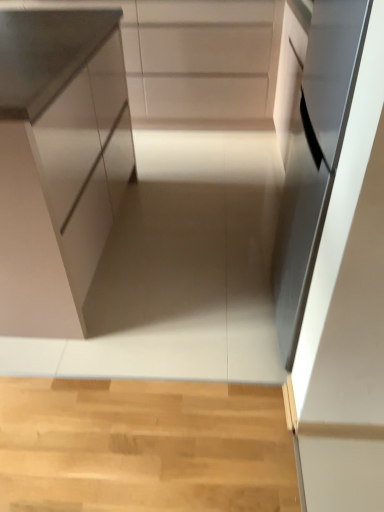
Identify the location of satin black oven at right. (315, 157).

The width and height of the screenshot is (384, 512). Describe the element at coordinates (58, 162) in the screenshot. I see `satin white cabinet at left, the second cabinetry when ordered from top to bottom` at that location.

Identify the location of satin white cabinet at left, which is the 1th cabinetry in bottom-to-top order. (58, 162).

Locate an element on the screen. The image size is (384, 512). white matte cabinet at upper center, the 2th cabinetry positioned from the bottom is located at coordinates (208, 60).

Based on the photo, from the image's perspective, is white matte cabinet at upper center, positioned as the first cabinetry in top-to-bottom order, above satin black oven at right?

Correct, white matte cabinet at upper center, positioned as the first cabinetry in top-to-bottom order, appears higher than satin black oven at right in the image.

How different are the orientations of white matte cabinet at upper center, marked as the 1th cabinetry in a back-to-front arrangement, and satin black oven at right in degrees?

The angular difference between white matte cabinet at upper center, marked as the 1th cabinetry in a back-to-front arrangement, and satin black oven at right is 90 degrees.

Is the surface of white matte cabinet at upper center, positioned as the first cabinetry in top-to-bottom order, in direct contact with satin black oven at right?

They are not placed beside each other.

From a real-world perspective, is white matte cabinet at upper center, marked as the 1th cabinetry in a back-to-front arrangement, on satin black oven at right?

No, from a real-world perspective, white matte cabinet at upper center, marked as the 1th cabinetry in a back-to-front arrangement, is not over satin black oven at right

From the image's perspective, which object appears higher, satin black oven at right or satin white cabinet at left, the second cabinetry when ordered from top to bottom?

satin white cabinet at left, the second cabinetry when ordered from top to bottom.

Is satin black oven at right turned away from satin white cabinet at left, the second cabinetry when ordered from back to front?

No, satin black oven at right's orientation is not away from satin white cabinet at left, the second cabinetry when ordered from back to front.

Between satin black oven at right and satin white cabinet at left, the second cabinetry when ordered from top to bottom, which one appears on the right side from the viewer's perspective?

satin black oven at right is more to the right.

Which object is more forward, satin black oven at right or satin white cabinet at left, the second cabinetry when ordered from back to front?

satin black oven at right is more forward.

Between satin white cabinet at left, the second cabinetry when ordered from back to front, and white matte cabinet at upper center, marked as the 1th cabinetry in a back-to-front arrangement, which one has smaller width?

Thinner between the two is white matte cabinet at upper center, marked as the 1th cabinetry in a back-to-front arrangement.

Which of these two, satin white cabinet at left, the first cabinetry positioned from the front, or white matte cabinet at upper center, positioned as the second cabinetry in front-to-back order, stands taller?

satin white cabinet at left, the first cabinetry positioned from the front.

Is satin white cabinet at left, the second cabinetry when ordered from top to bottom, in front of or behind white matte cabinet at upper center, marked as the 1th cabinetry in a back-to-front arrangement, in the image?

satin white cabinet at left, the second cabinetry when ordered from top to bottom, is in front of white matte cabinet at upper center, marked as the 1th cabinetry in a back-to-front arrangement.

Looking at this image, is satin white cabinet at left, the second cabinetry when ordered from top to bottom, bigger or smaller than white matte cabinet at upper center, positioned as the first cabinetry in top-to-bottom order?

satin white cabinet at left, the second cabinetry when ordered from top to bottom, is bigger than white matte cabinet at upper center, positioned as the first cabinetry in top-to-bottom order.

This screenshot has width=384, height=512. Identify the location of cabinetry above the white matte cabinet at upper center, positioned as the first cabinetry in top-to-bottom order (from a real-world perspective). (58, 162).

Who is bigger, white matte cabinet at upper center, positioned as the first cabinetry in top-to-bottom order, or satin white cabinet at left, the first cabinetry positioned from the front?

Bigger between the two is satin white cabinet at left, the first cabinetry positioned from the front.

How many degrees apart are the facing directions of white matte cabinet at upper center, marked as the 1th cabinetry in a back-to-front arrangement, and satin white cabinet at left, the second cabinetry when ordered from top to bottom?

There is a 90.7-degree angle between the facing directions of white matte cabinet at upper center, marked as the 1th cabinetry in a back-to-front arrangement, and satin white cabinet at left, the second cabinetry when ordered from top to bottom.

Between point (271, 114) and point (102, 36), which one is positioned in front?

The point (102, 36) is closer.

Is the surface of satin white cabinet at left, the first cabinetry positioned from the front, in direct contact with satin black oven at right?

No, satin white cabinet at left, the first cabinetry positioned from the front, is not in contact with satin black oven at right.

Find the location of a particular element. The height and width of the screenshot is (512, 384). cabinetry that is the 1st object located behind the satin black oven at right is located at coordinates (58, 162).

In the image, is satin white cabinet at left, which is the 1th cabinetry in bottom-to-top order, on the left side or the right side of satin black oven at right?

In the image, satin white cabinet at left, which is the 1th cabinetry in bottom-to-top order, appears on the left side of satin black oven at right.

In the image, is satin white cabinet at left, which is the 1th cabinetry in bottom-to-top order, positioned in front of or behind satin black oven at right?

satin white cabinet at left, which is the 1th cabinetry in bottom-to-top order, is positioned farther from the viewer than satin black oven at right.

Is satin black oven at right in front of or behind white matte cabinet at upper center, the 2th cabinetry positioned from the bottom, in the image?

satin black oven at right is in front of white matte cabinet at upper center, the 2th cabinetry positioned from the bottom.

From a real-world perspective, between satin black oven at right and white matte cabinet at upper center, positioned as the second cabinetry in front-to-back order, who is vertically higher?

From a 3D spatial view, satin black oven at right is above.

From the image's perspective, is satin black oven at right over white matte cabinet at upper center, the 2th cabinetry positioned from the bottom?

Incorrect, from the image's perspective, satin black oven at right is lower than white matte cabinet at upper center, the 2th cabinetry positioned from the bottom.

I want to click on oven above the white matte cabinet at upper center, marked as the 1th cabinetry in a back-to-front arrangement (from a real-world perspective), so click(315, 157).

Image resolution: width=384 pixels, height=512 pixels. There is a satin black oven at right. Find the location of `the 1st cabinetry below it (from a real-world perspective)`. the 1st cabinetry below it (from a real-world perspective) is located at coordinates (58, 162).

Estimate the real-world distances between objects in this image. Which object is closer to satin black oven at right, white matte cabinet at upper center, the 2th cabinetry positioned from the bottom, or satin white cabinet at left, the second cabinetry when ordered from back to front?

satin white cabinet at left, the second cabinetry when ordered from back to front, lies closer to satin black oven at right than the other object.

Which object lies further to the anchor point white matte cabinet at upper center, positioned as the second cabinetry in front-to-back order, satin black oven at right or satin white cabinet at left, which is the 1th cabinetry in bottom-to-top order?

satin black oven at right lies further to white matte cabinet at upper center, positioned as the second cabinetry in front-to-back order, than the other object.

From the image, which object appears to be nearer to white matte cabinet at upper center, positioned as the second cabinetry in front-to-back order, satin white cabinet at left, which is the 1th cabinetry in bottom-to-top order, or satin black oven at right?

satin white cabinet at left, which is the 1th cabinetry in bottom-to-top order, is closer to white matte cabinet at upper center, positioned as the second cabinetry in front-to-back order.

Considering their positions, is white matte cabinet at upper center, marked as the 1th cabinetry in a back-to-front arrangement, positioned further to satin white cabinet at left, the first cabinetry positioned from the front, than satin black oven at right?

Among the two, white matte cabinet at upper center, marked as the 1th cabinetry in a back-to-front arrangement, is located further to satin white cabinet at left, the first cabinetry positioned from the front.

Considering their positions, is satin black oven at right positioned further to satin white cabinet at left, the second cabinetry when ordered from back to front, than white matte cabinet at upper center, positioned as the first cabinetry in top-to-bottom order?

Among the two, white matte cabinet at upper center, positioned as the first cabinetry in top-to-bottom order, is located further to satin white cabinet at left, the second cabinetry when ordered from back to front.

Estimate the real-world distances between objects in this image. Which object is closer to satin black oven at right, satin white cabinet at left, which is the 1th cabinetry in bottom-to-top order, or white matte cabinet at upper center, marked as the 1th cabinetry in a back-to-front arrangement?

The object closer to satin black oven at right is satin white cabinet at left, which is the 1th cabinetry in bottom-to-top order.

Where is `cabinetry located between satin black oven at right and white matte cabinet at upper center, positioned as the first cabinetry in top-to-bottom order, in the depth direction`? This screenshot has height=512, width=384. cabinetry located between satin black oven at right and white matte cabinet at upper center, positioned as the first cabinetry in top-to-bottom order, in the depth direction is located at coordinates (58, 162).